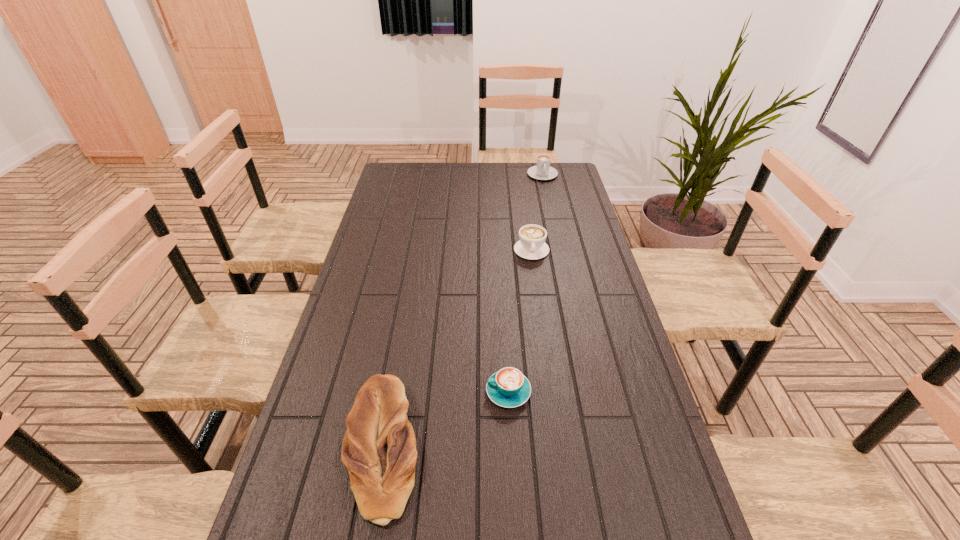
Point out which object is positioned as the second nearest to the farthest cappuccino. Please provide its 2D coordinates. Your answer should be formatted as a tuple, i.e. [(x, y)], where the tuple contains the x and y coordinates of a point satisfying the conditions above.

[(508, 387)]

You are a GUI agent. You are given a task and a screenshot of the screen. Output one action in this format:
    pyautogui.click(x=<x>, y=<y>)
    Task: Click on the object that is the nearest to the second farthest object
    The width and height of the screenshot is (960, 540).
    Given the screenshot: What is the action you would take?
    pyautogui.click(x=543, y=171)

You are a GUI agent. You are given a task and a screenshot of the screen. Output one action in this format:
    pyautogui.click(x=<x>, y=<y>)
    Task: Click on the cappuccino that is the third closest to the bread
    The image size is (960, 540).
    Given the screenshot: What is the action you would take?
    pyautogui.click(x=543, y=171)

This screenshot has width=960, height=540. Identify the location of cappuccino that stands as the second closest to the third nearest object. (508, 387).

This screenshot has height=540, width=960. I want to click on free space in the image that satisfies the following two spatial constraints: 1. to the right of the farthest cappuccino; 2. with the handle on the right side of the shortest object, so click(x=590, y=392).

Identify the location of vacant space that satisfies the following two spatial constraints: 1. to the right of the farthest object; 2. with the handle on the right side of the nearest cappuccino. The width and height of the screenshot is (960, 540). (590, 392).

Find the location of a particular element. The height and width of the screenshot is (540, 960). free spot that satisfies the following two spatial constraints: 1. to the right of the farthest cappuccino; 2. with the handle on the right side of the nearest cappuccino is located at coordinates (590, 392).

You are a GUI agent. You are given a task and a screenshot of the screen. Output one action in this format:
    pyautogui.click(x=<x>, y=<y>)
    Task: Click on the free space that satisfies the following two spatial constraints: 1. to the right of the farthest object; 2. with the handle on the right side of the shortest object
    This screenshot has width=960, height=540.
    Given the screenshot: What is the action you would take?
    pyautogui.click(x=590, y=392)

You are a GUI agent. You are given a task and a screenshot of the screen. Output one action in this format:
    pyautogui.click(x=<x>, y=<y>)
    Task: Click on the vacant region that satisfies the following two spatial constraints: 1. to the right of the second farthest cappuccino's handle; 2. with the handle on the right side of the nearest cappuccino
    The width and height of the screenshot is (960, 540).
    Given the screenshot: What is the action you would take?
    pyautogui.click(x=552, y=392)